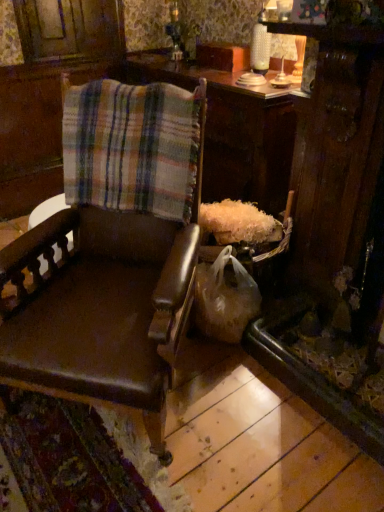
You are a GUI agent. You are given a task and a screenshot of the screen. Output one action in this format:
    pyautogui.click(x=<x>, y=<y>)
    Task: Click on the brown leather chair at left
    This screenshot has width=384, height=512.
    Given the screenshot: What is the action you would take?
    pyautogui.click(x=103, y=304)

Which object is more forward, wooden table at center or brown leather chair at left?

brown leather chair at left is in front.

Are wooden table at center and brown leather chair at left far apart?

No.

Who is shorter, wooden table at center or brown leather chair at left?

wooden table at center.

Is wooden table at center thinner than brown leather chair at left?

Yes, wooden table at center is thinner than brown leather chair at left.

Is wooden table at center positioned with its back to plaid fabric at center?

wooden table at center does not have its back to plaid fabric at center.

Are wooden table at center and plaid fabric at center beside each other?

No, wooden table at center is not beside plaid fabric at center.

Considering the relative sizes of wooden table at center and plaid fabric at center in the image provided, is wooden table at center smaller than plaid fabric at center?

Incorrect, wooden table at center is not smaller in size than plaid fabric at center.

From the image's perspective, does wooden table at center appear lower than plaid fabric at center?

No, from the image's perspective, wooden table at center is not beneath plaid fabric at center.

Locate an element on the screen. table behind the brown leather chair at left is located at coordinates (234, 130).

Could wooden table at center be considered to be inside brown leather chair at left?

No.

Considering the relative sizes of brown leather chair at left and wooden table at center in the image provided, is brown leather chair at left wider than wooden table at center?

Result: Yes.

From a real-world perspective, relative to plaid fabric at center, is brown leather chair at left vertically above or below?

In terms of real-world spatial position, brown leather chair at left is below plaid fabric at center.

Where is `chair lying on the left of plaid fabric at center`? This screenshot has width=384, height=512. chair lying on the left of plaid fabric at center is located at coordinates (103, 304).

Can you confirm if brown leather chair at left is wider than plaid fabric at center?

Yes.

In the scene shown: Are plaid fabric at center and wooden table at center far apart?

No, plaid fabric at center is in close proximity to wooden table at center.

Which is more to the left, plaid fabric at center or wooden table at center?

plaid fabric at center is more to the left.

From a real-world perspective, is plaid fabric at center below wooden table at center?

No, from a real-world perspective, plaid fabric at center is not below wooden table at center.

From the image's perspective, would you say plaid fabric at center is positioned over brown leather chair at left?

Yes, from the image's perspective, plaid fabric at center is over brown leather chair at left.

Does plaid fabric at center have a greater width compared to brown leather chair at left?

Incorrect, the width of plaid fabric at center does not surpass that of brown leather chair at left.

Which object is closer to the camera taking this photo, plaid fabric at center or brown leather chair at left?

brown leather chair at left is in front.

Find the location of a particular element. chair located below the wooden table at center (from the image's perspective) is located at coordinates (103, 304).

What are the coordinates of `table located underneath the plaid fabric at center (from a real-world perspective)` in the screenshot? It's located at (234, 130).

In the scene shown: Considering their positions, is brown leather chair at left positioned closer to plaid fabric at center than wooden table at center?

brown leather chair at left lies closer to plaid fabric at center than the other object.

Estimate the real-world distances between objects in this image. Which object is closer to wooden table at center, plaid fabric at center or brown leather chair at left?

The object closer to wooden table at center is plaid fabric at center.

Based on their spatial positions, is brown leather chair at left or plaid fabric at center further from wooden table at center?

Among the two, brown leather chair at left is located further to wooden table at center.

Based on their spatial positions, is wooden table at center or brown leather chair at left closer to plaid fabric at center?

brown leather chair at left is positioned closer to the anchor plaid fabric at center.

Based on their spatial positions, is plaid fabric at center or wooden table at center closer to brown leather chair at left?

plaid fabric at center lies closer to brown leather chair at left than the other object.

Which object lies further to the anchor point brown leather chair at left, wooden table at center or plaid fabric at center?

wooden table at center.

Locate an element on the screen. flannel between brown leather chair at left and wooden table at center from front to back is located at coordinates (132, 147).